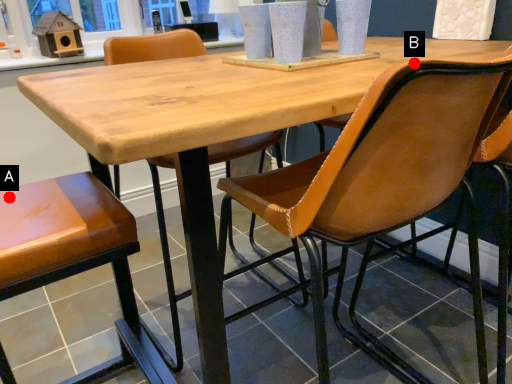
Question: Two points are circled on the image, labeled by A and B beside each circle. Which point appears closest to the camera in this image?

Choices:
 (A) A is closer
 (B) B is closer

Answer: (B)